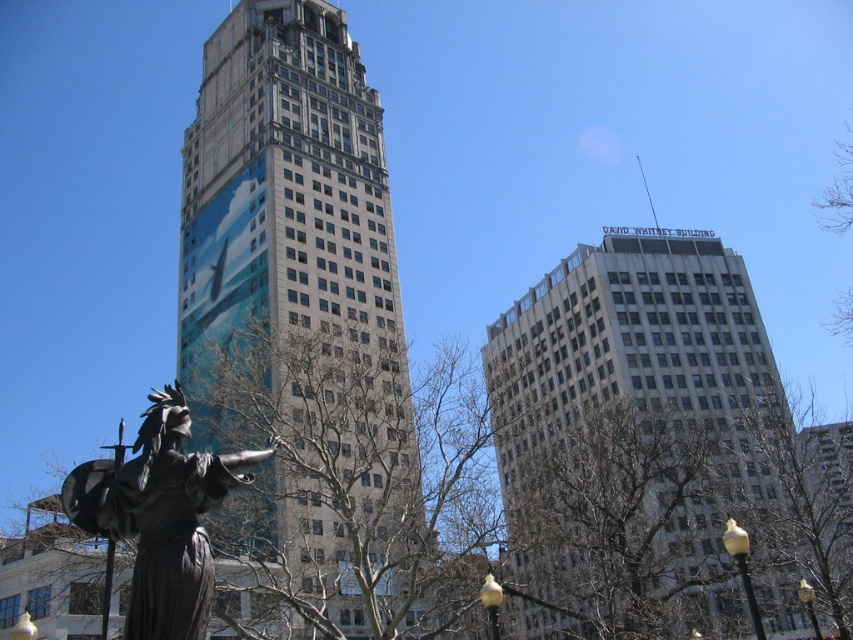
What are the coordinates of the metallic glass skyscraper at center?

The metallic glass skyscraper at center is located at coordinates point (300, 321).

You are an architect planning to install a new light fixture between the white glass building at upper right and the bronze statue at lower left. To ensure safety, you need to know the distance between them. Can you determine if the distance is sufficient for a 2.5 meter wide fixture?

The distance between the white glass building at upper right and the bronze statue at lower left is not provided in the given information. Therefore, it is impossible to determine if the 2.5 meter wide fixture can be safely installed between them.